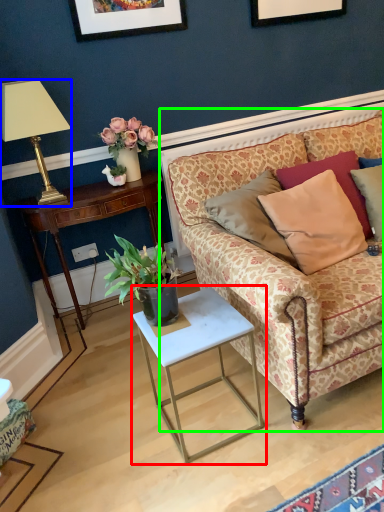
Question: Which object is the farthest from table (highlighted by a red box)? Choose among these: lamp (highlighted by a blue box) or studio couch (highlighted by a green box).

Choices:
 (A) lamp
 (B) studio couch

Answer: (A)